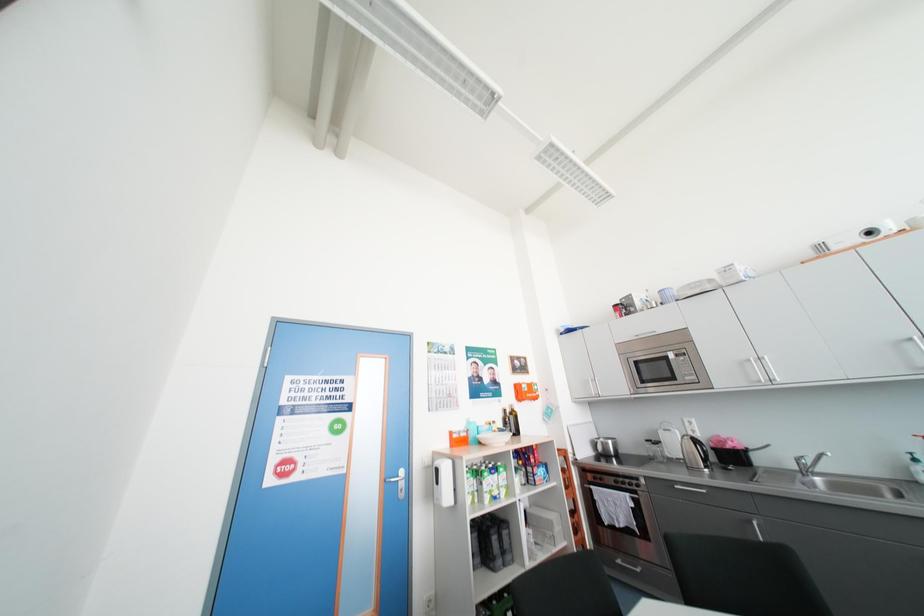
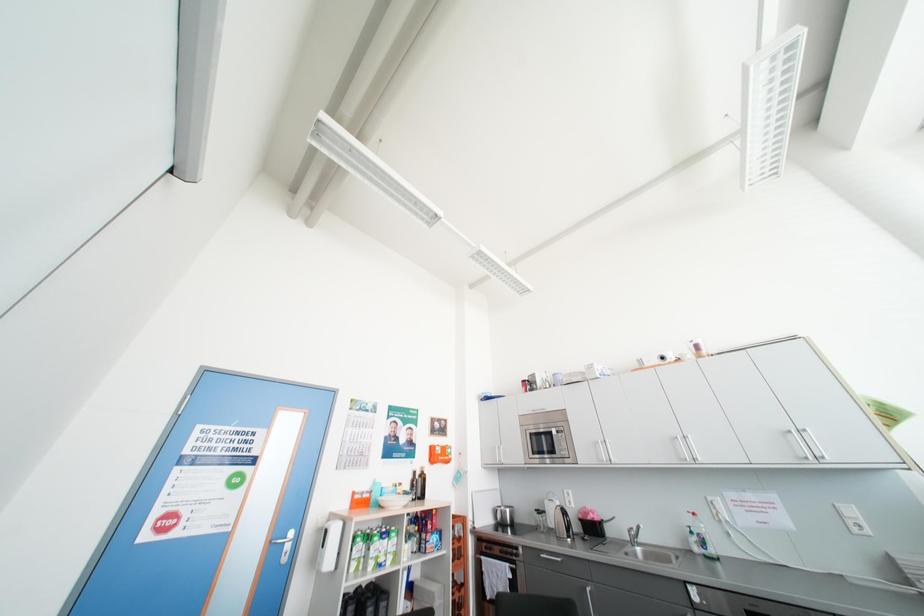
Question: How did the camera likely rotate?

Choices:
 (A) Left
 (B) Right
 (C) Up
 (D) Down

Answer: (C)